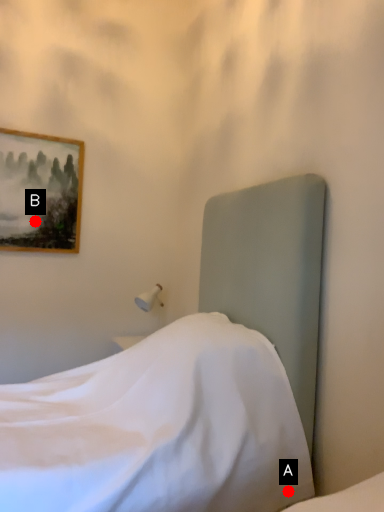
Question: Two points are circled on the image, labeled by A and B beside each circle. Which point is closer to the camera taking this photo?

Choices:
 (A) A is closer
 (B) B is closer

Answer: (A)